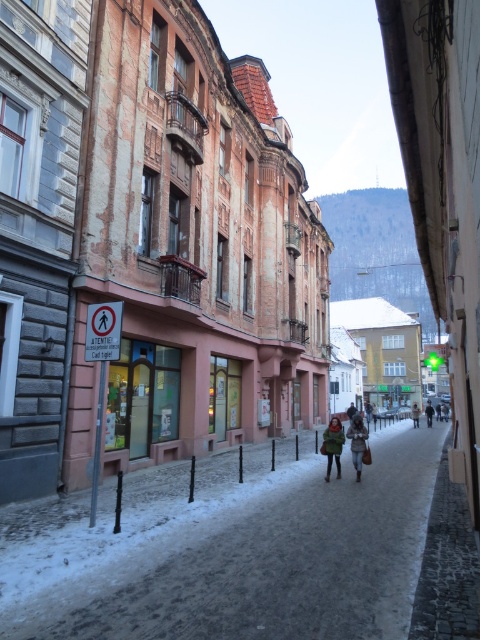
In the scene shown: Can you confirm if snowy cobblestone alley at center is taller than green fuzzy coat at center?

No.

Where is `snowy cobblestone alley at center`? This screenshot has height=640, width=480. snowy cobblestone alley at center is located at coordinates (228, 552).

Locate an element on the screen. The height and width of the screenshot is (640, 480). snowy cobblestone alley at center is located at coordinates (228, 552).

Is snowy cobblestone alley at center closer to the viewer compared to dark brown leather coat at center?

Yes, snowy cobblestone alley at center is closer to the viewer.

Is point (296, 600) positioned before point (354, 417)?

Yes, point (296, 600) is closer to viewer.

Locate an element on the screen. snowy cobblestone alley at center is located at coordinates pyautogui.click(x=228, y=552).

Between green fuzzy coat at center and dark brown leather coat at center, which one is positioned higher?

dark brown leather coat at center is above.

Who is shorter, green fuzzy coat at center or dark brown leather coat at center?

dark brown leather coat at center

Is point (339, 454) closer to camera compared to point (362, 420)?

That is True.

In order to click on green fuzzy coat at center in this screenshot , I will do `click(333, 445)`.